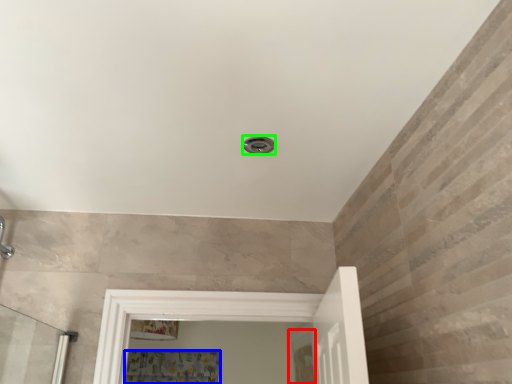
Question: Estimate the real-world distances between objects in this image. Which object is farther from screen door (highlighted by a red box), shower curtain (highlighted by a blue box) or shower (highlighted by a green box)?

Choices:
 (A) shower curtain
 (B) shower

Answer: (B)